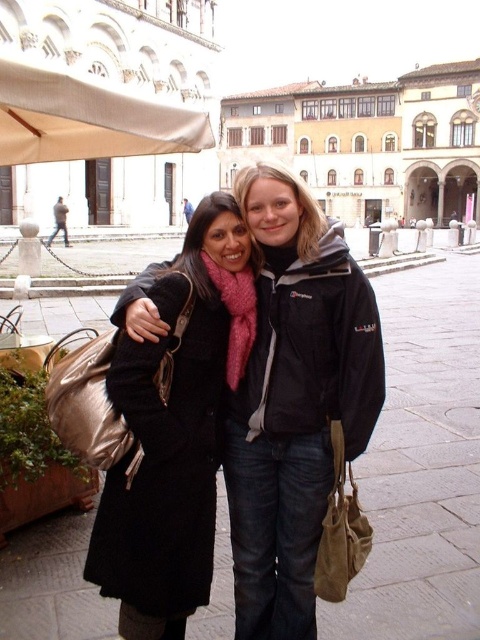
You are a photographer positioned at the center of the plaza. You want to take a photo that includes both the black matte jacket at center and the black wool coat at center. The camera you are using has a maximum focus range of 3 meters. Will both subjects be in focus?

The black matte jacket at center is 3.61 meters away from the black wool coat at center. Since the camera can only focus within 3 meters, the distance between them exceeds the focus range. Therefore, both subjects cannot be in focus simultaneously.

You are a photographer positioned at the entrance of the plaza. You want to take a photo of the black matte jacket at center without including the beige fabric canopy at upper left in the frame. Based on their positions, is this possible?

The black matte jacket at center is to the right of the beige fabric canopy at upper left, so if you position yourself to the right side of the plaza entrance and frame the shot to exclude the upper left area, you can capture the black matte jacket at center without including the beige fabric canopy at upper left.